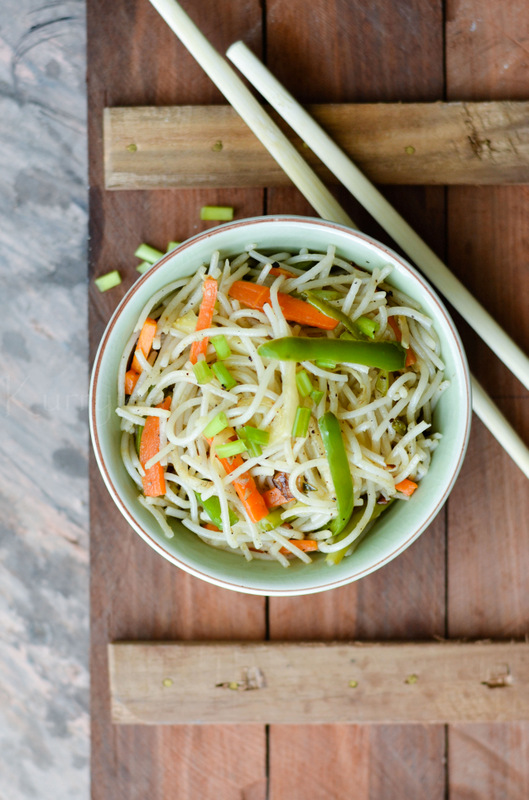
The height and width of the screenshot is (800, 529). I want to click on countertop, so click(x=70, y=658).